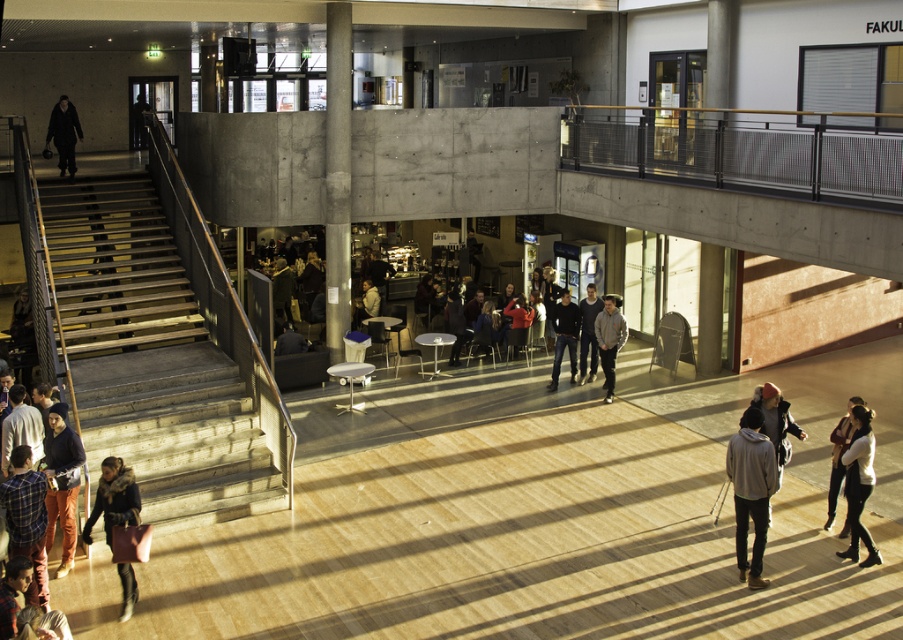
Consider the image. You are a security guard in the building and need to retrieve both the matte black jacket at lower left and the dark blue jeans at center. If you start at the staircase, which item would you reach first, and why?

You would reach the matte black jacket at lower left first because it is closer to the staircase than the dark blue jeans at center, which are 9.62 meters away from the jacket.